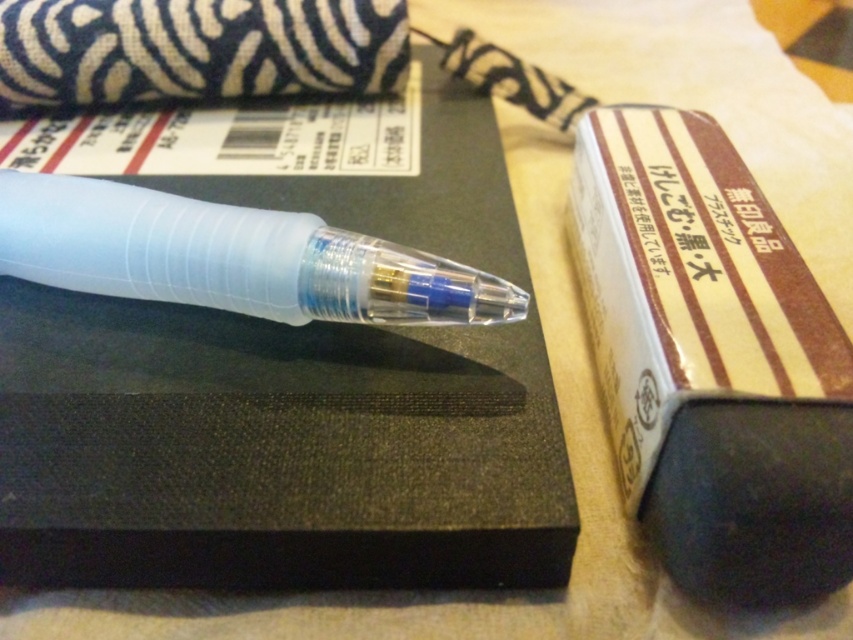
You are looking at the image and want to determine which of the two points, point [91,406] or point [119,212], is closer to you. Can you identify the closer one?

Point [91,406] is closer to the viewer than point [119,212].

You are organizing your desk and notice the black matte notebook at center and the translucent plastic pen at center. Which object is positioned to the right of the other?

The black matte notebook at center is to the right of the translucent plastic pen at center.

You are trying to place a sticker exactly at the center of the black matte notebook at center. According to the coordinates provided, where should you place the sticker?

The sticker should be placed at the coordinates point (273, 451) since that is the center point of the black matte notebook at center.